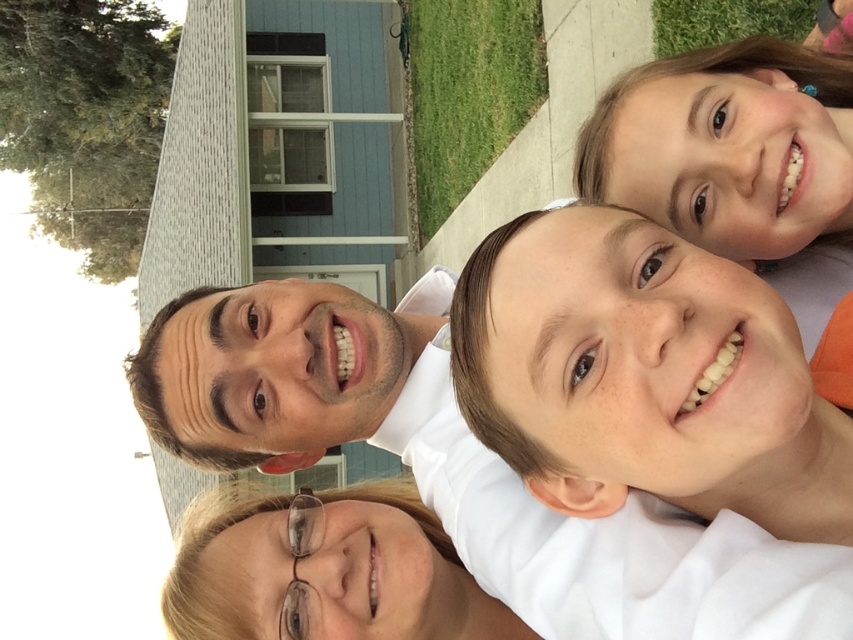
You are a photographer trying to focus on the clear plastic glasses at lower center in the image. However, the white smooth shirt at center is blocking your view. Can you adjust your position to capture the glasses without the shirt obstructing them?

The white smooth shirt at center is in front of the clear plastic glasses at lower center, so moving your camera angle slightly downward or to the side might allow you to capture the glasses without the shirt blocking them.

You are standing in front of the blue house with white framed windows and gray roof in the background. You see a point at coordinates [643,376]. What object is located at that point?

The point at coordinates [643,376] indicates the white smooth shirt at center.

You are a photographer trying to capture a detailed closeup of the clear plastic glasses at lower center and the green grass at lower left. Which object should you zoom in on to ensure it takes up more of the frame without moving the camera?

The green grass at lower left should be zoomed in on because it occupies more space than the clear plastic glasses at lower center, allowing it to fill the frame better without moving the camera.